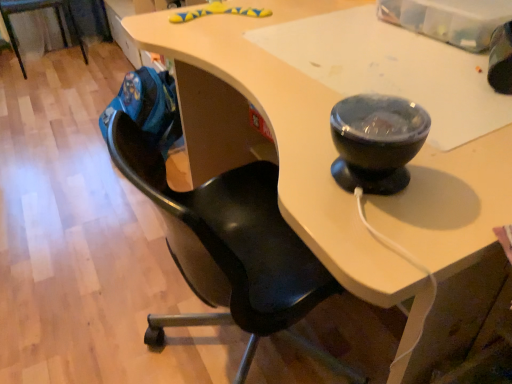
Locate an element on the screen. The width and height of the screenshot is (512, 384). vacant region in front of black leather chair at left, the 2th chair viewed from the front is located at coordinates (35, 86).